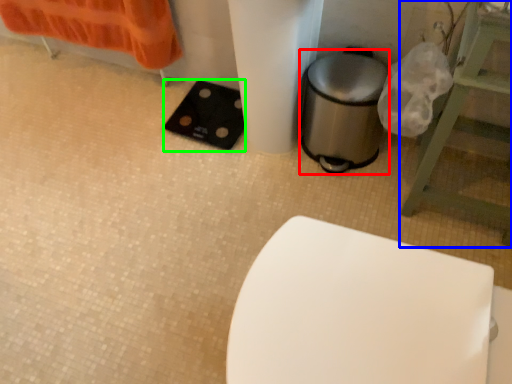
Question: Based on their relative distances, which object is farther from appliance (highlighted by a red box)? Choose from furniture (highlighted by a blue box) and pad (highlighted by a green box).

Choices:
 (A) furniture
 (B) pad

Answer: (B)